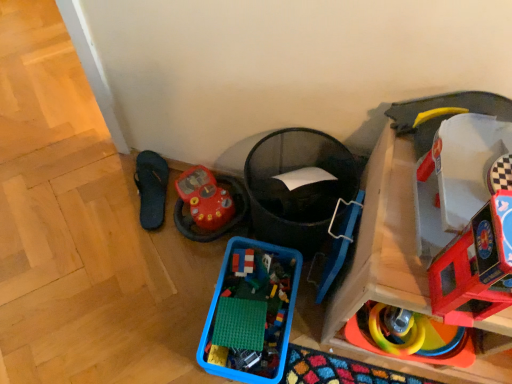
Question: Is smooth plastic toy car at right, the fifth toy viewed from the left, facing towards translucent plastic bricks at center, which is counted as the fifth toy, starting from the right?

Choices:
 (A) no
 (B) yes

Answer: (A)

Question: Can you confirm if smooth plastic toy car at right, arranged as the second toy when viewed from the right, is taller than translucent plastic bricks at center, the second toy from the left?

Choices:
 (A) no
 (B) yes

Answer: (B)

Question: Considering the relative positions of smooth plastic toy car at right, arranged as the second toy when viewed from the right, and translucent plastic bricks at center, the second toy from the left, in the image provided, is smooth plastic toy car at right, arranged as the second toy when viewed from the right, to the left of translucent plastic bricks at center, the second toy from the left, from the viewer's perspective?

Choices:
 (A) no
 (B) yes

Answer: (A)

Question: From the image's perspective, is smooth plastic toy car at right, arranged as the second toy when viewed from the right, located above translucent plastic bricks at center, the second toy from the left?

Choices:
 (A) yes
 (B) no

Answer: (A)

Question: Is smooth plastic toy car at right, arranged as the second toy when viewed from the right, surrounding translucent plastic bricks at center, which is counted as the fifth toy, starting from the right?

Choices:
 (A) no
 (B) yes

Answer: (A)

Question: Based on their sizes in the image, would you say black rubber flip-flop at lower left is bigger or smaller than blue plastic container at lower center, placed as the 4th toy when sorted from right to left?

Choices:
 (A) small
 (B) big

Answer: (A)

Question: Based on their positions, is black rubber flip-flop at lower left located to the left or right of blue plastic container at lower center, which is the third toy from left to right?

Choices:
 (A) right
 (B) left

Answer: (B)

Question: Is black rubber flip-flop at lower left spatially inside blue plastic container at lower center, placed as the 4th toy when sorted from right to left, or outside of it?

Choices:
 (A) outside
 (B) inside

Answer: (A)

Question: From a real-world perspective, relative to blue plastic container at lower center, placed as the 4th toy when sorted from right to left, is black rubber flip-flop at lower left vertically above or below?

Choices:
 (A) below
 (B) above

Answer: (A)

Question: From a real-world perspective, is translucent plastic bricks at center, the second toy from the left, positioned above or below blue plastic container at lower center, placed as the 4th toy when sorted from right to left?

Choices:
 (A) below
 (B) above

Answer: (B)

Question: In the image, is translucent plastic bricks at center, which is counted as the fifth toy, starting from the right, positioned in front of or behind blue plastic container at lower center, which is the third toy from left to right?

Choices:
 (A) behind
 (B) front

Answer: (A)

Question: Considering the positions of translucent plastic bricks at center, the second toy from the left, and blue plastic container at lower center, placed as the 4th toy when sorted from right to left, in the image, is translucent plastic bricks at center, the second toy from the left, taller or shorter than blue plastic container at lower center, placed as the 4th toy when sorted from right to left,?

Choices:
 (A) tall
 (B) short

Answer: (B)

Question: Visually, is translucent plastic bricks at center, the second toy from the left, positioned to the left or to the right of blue plastic container at lower center, placed as the 4th toy when sorted from right to left?

Choices:
 (A) right
 (B) left

Answer: (B)

Question: Based on their positions, is rubberized plastic rings at lower right, marked as the fourth toy in a left-to-right arrangement, located to the left or right of smooth plastic toy car at right, arranged as the second toy when viewed from the right?

Choices:
 (A) left
 (B) right

Answer: (A)

Question: From their relative heights in the image, would you say rubberized plastic rings at lower right, marked as the 3th toy in a right-to-left arrangement, is taller or shorter than smooth plastic toy car at right, arranged as the second toy when viewed from the right?

Choices:
 (A) short
 (B) tall

Answer: (A)